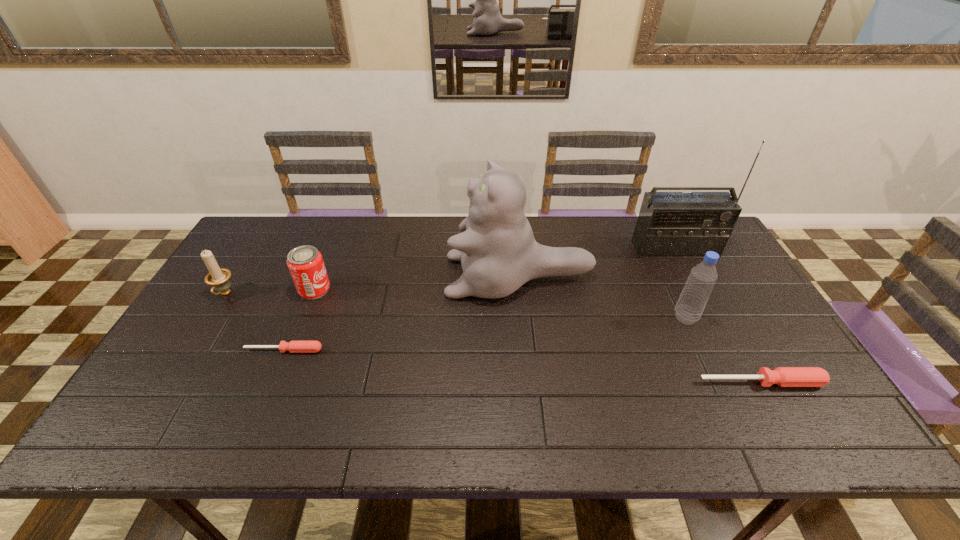
What are the coordinates of `the fourth closest object relative to the leftmost object` in the screenshot? It's located at (670, 224).

Locate an element on the screen. The image size is (960, 540). object that is the fifth closest to the third shortest object is located at coordinates (689, 308).

Find the location of a particular element. This screenshot has height=540, width=960. blank space that satisfies the following two spatial constraints: 1. on the back side of the farther screwdriver; 2. on the right side of the can is located at coordinates (x=309, y=289).

Image resolution: width=960 pixels, height=540 pixels. I want to click on vacant space that satisfies the following two spatial constraints: 1. on the front panel of the radio receiver; 2. on the left side of the nearer screwdriver, so click(745, 382).

Find the location of `vacant space that satisfies the following two spatial constraints: 1. on the face of the fourth object from right to left; 2. on the left side of the third nearest object`. vacant space that satisfies the following two spatial constraints: 1. on the face of the fourth object from right to left; 2. on the left side of the third nearest object is located at coordinates (523, 318).

Identify the location of vacant space that satisfies the following two spatial constraints: 1. on the front side of the left screwdriver; 2. on the right side of the taller screwdriver. The image size is (960, 540). pyautogui.click(x=271, y=382).

Identify the location of free location that satisfies the following two spatial constraints: 1. on the handle side of the fifth farthest object; 2. on the left side of the candle_holder. (210, 318).

The height and width of the screenshot is (540, 960). In order to click on vacant space that satisfies the following two spatial constraints: 1. on the face of the cat; 2. on the right side of the third tallest object in this screenshot , I will do (x=523, y=318).

Identify the location of blank area in the image that satisfies the following two spatial constraints: 1. on the handle side of the shortest object; 2. on the left side of the candle_holder. The height and width of the screenshot is (540, 960). (190, 350).

In order to click on free location that satisfies the following two spatial constraints: 1. on the handle side of the leftmost object; 2. on the left side of the fifth farthest object in this screenshot , I will do `click(210, 318)`.